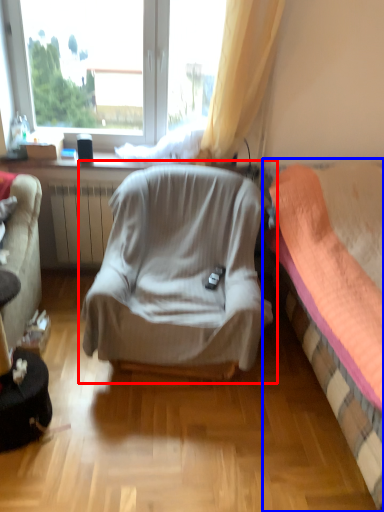
Question: Which point is closer to the camera, chair (highlighted by a red box) or bed (highlighted by a blue box)?

Choices:
 (A) chair
 (B) bed

Answer: (B)